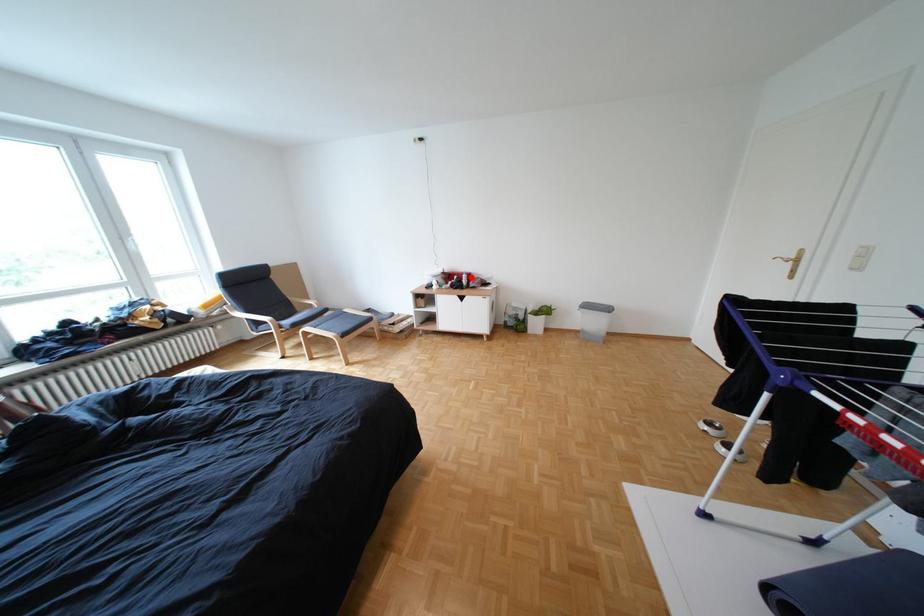
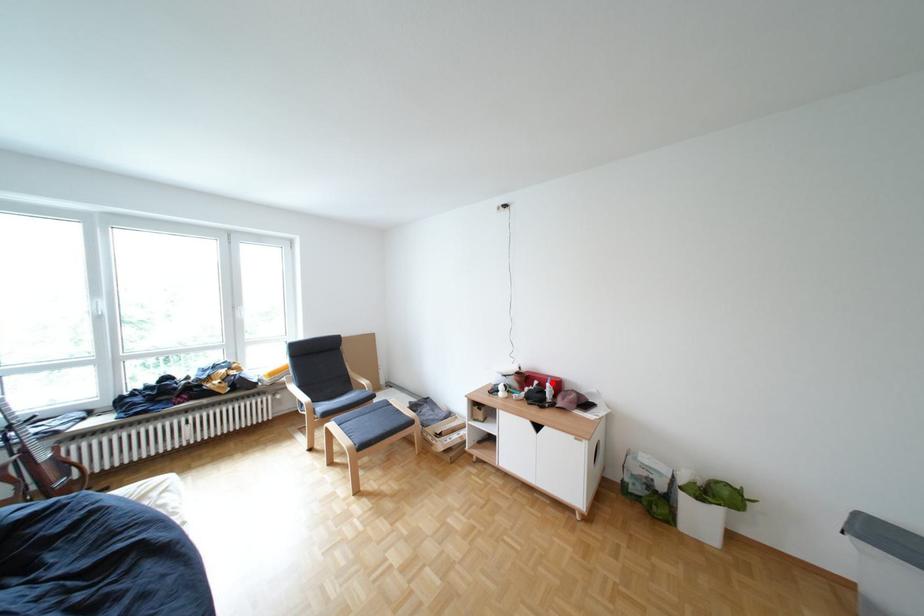
I am providing you with two images of the same scene from different viewpoints. A red point is marked on the first image and another point is marked on the second image. Is the red point in image1 aligned with the point shown in image2?

Yes